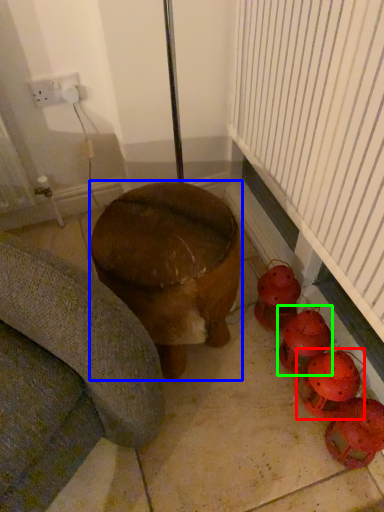
Question: Estimate the real-world distances between objects in this image. Which object is closer to toy (highlighted by a red box), furniture (highlighted by a blue box) or toy (highlighted by a green box)?

Choices:
 (A) furniture
 (B) toy

Answer: (B)